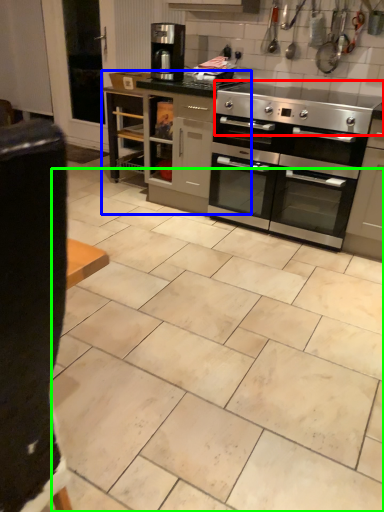
Question: Based on their relative distances, which object is farther from gas stove (highlighted by a red box)? Choose from cabinetry (highlighted by a blue box) and ceramic tile (highlighted by a green box).

Choices:
 (A) cabinetry
 (B) ceramic tile

Answer: (B)